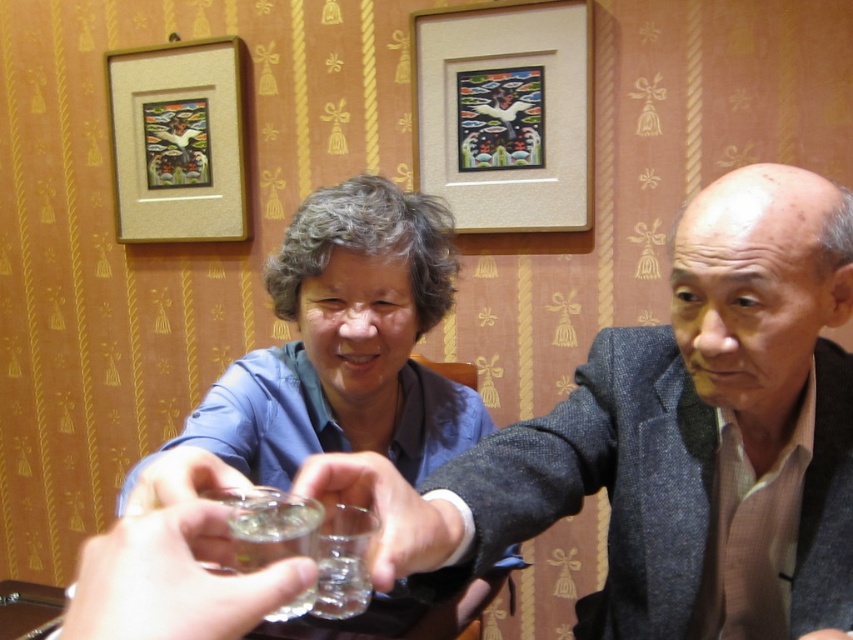
You are a photographer taking a picture of the scene. You notice the gray wool suit at center and the blue fabric shirt at center. Which one should you focus on if you want to capture the upper part of the scene?

The gray wool suit at center is located above the blue fabric shirt at center, so focusing on the gray wool suit at center would capture the upper part of the scene.

You are a photographer trying to capture a group photo of the people at the table. Given that the gray wool suit at center and the blue fabric shirt at center are both in the frame, which clothing item should you focus on to ensure the entire group is visible in the photo?

The gray wool suit at center is wider than the blue fabric shirt at center, so focusing on the gray wool suit at center would help ensure the entire group is visible as it occupies more space in the frame.